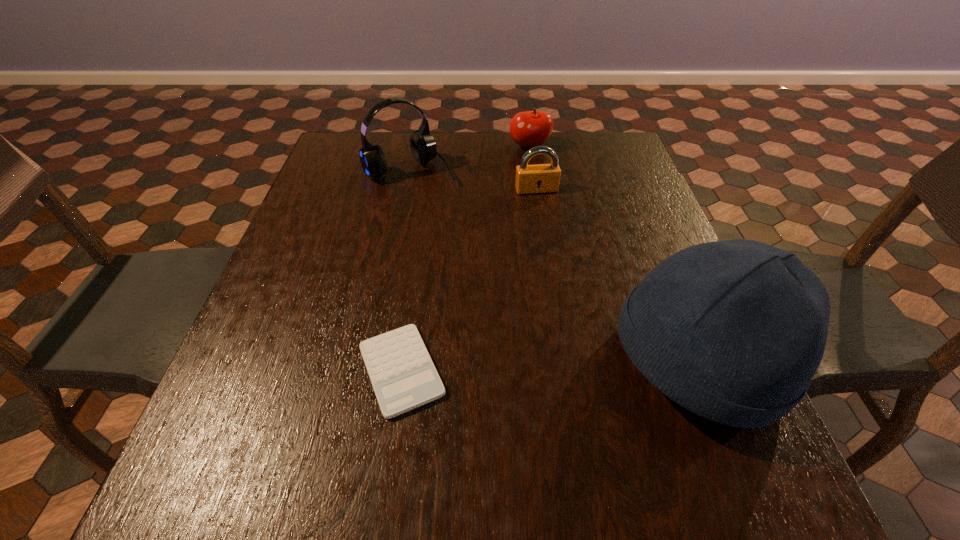
This screenshot has width=960, height=540. I want to click on skullcap located in the near edge section of the desktop, so click(x=734, y=331).

I want to click on object that is at the left edge, so click(x=423, y=147).

The height and width of the screenshot is (540, 960). I want to click on object that is at the right edge, so click(734, 331).

At what (x,y) coordinates should I click in order to perform the action: click on object situated at the far left corner. Please return your answer as a coordinate pair (x, y). Looking at the image, I should click on click(x=423, y=147).

Find the location of a particular element. The height and width of the screenshot is (540, 960). object located in the near right corner section of the desktop is located at coordinates (734, 331).

Where is `vacant region at the far edge`? This screenshot has width=960, height=540. vacant region at the far edge is located at coordinates (554, 140).

You are a GUI agent. You are given a task and a screenshot of the screen. Output one action in this format:
    pyautogui.click(x=<x>, y=<y>)
    Task: Click on the vacant area at the near edge
    The width and height of the screenshot is (960, 540).
    Given the screenshot: What is the action you would take?
    pyautogui.click(x=373, y=403)

Identify the location of blank space at the left edge of the desktop. Image resolution: width=960 pixels, height=540 pixels. (314, 360).

The width and height of the screenshot is (960, 540). Find the location of `vacant space at the right edge of the desktop`. vacant space at the right edge of the desktop is located at coordinates (622, 299).

In the image, there is a desktop. At what (x,y) coordinates should I click in order to perform the action: click on vacant space at the near left corner. Please return your answer as a coordinate pair (x, y). Looking at the image, I should click on (253, 400).